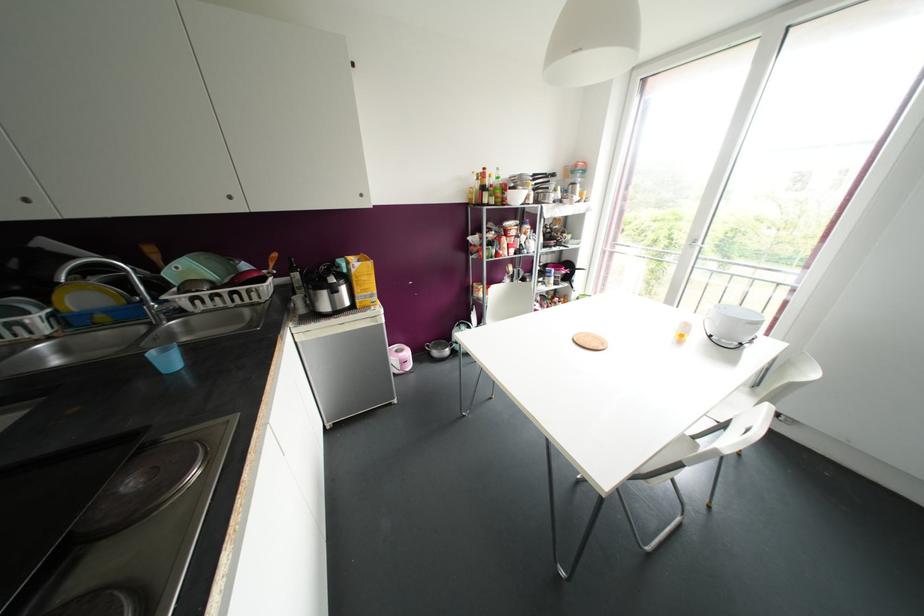
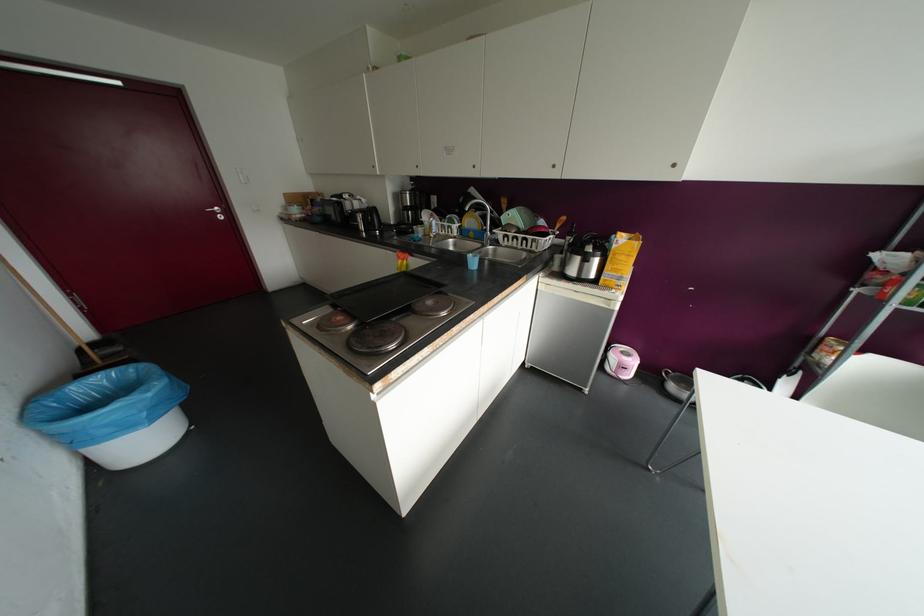
In the second image, find the point that corresponds to point (129, 436) in the first image.

(441, 284)